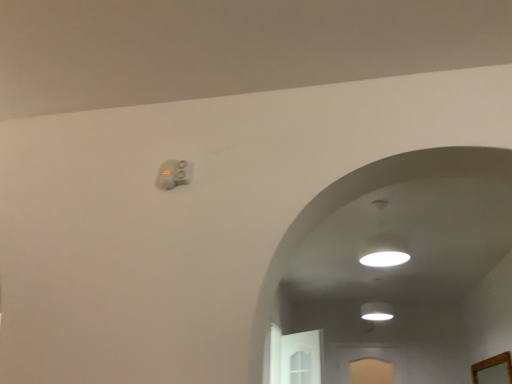
Question: Considering the relative sizes of wooden mirror at lower right and white glossy lampshade at upper center in the image provided, is wooden mirror at lower right smaller than white glossy lampshade at upper center?

Choices:
 (A) yes
 (B) no

Answer: (A)

Question: Considering the relative positions of wooden mirror at lower right and white glossy lampshade at upper center in the image provided, is wooden mirror at lower right to the right of white glossy lampshade at upper center from the viewer's perspective?

Choices:
 (A) yes
 (B) no

Answer: (A)

Question: Does wooden mirror at lower right lie behind white glossy lampshade at upper center?

Choices:
 (A) yes
 (B) no

Answer: (A)

Question: From the image's perspective, is wooden mirror at lower right beneath white glossy lampshade at upper center?

Choices:
 (A) yes
 (B) no

Answer: (A)

Question: Considering the relative sizes of wooden mirror at lower right and white glossy lampshade at upper center in the image provided, is wooden mirror at lower right shorter than white glossy lampshade at upper center?

Choices:
 (A) no
 (B) yes

Answer: (B)

Question: From the image's perspective, would you say wooden mirror at lower right is positioned over white glossy lampshade at upper center?

Choices:
 (A) no
 (B) yes

Answer: (A)

Question: Does white glossy lampshade at upper center appear on the right side of wooden mirror at lower right?

Choices:
 (A) no
 (B) yes

Answer: (A)

Question: Is white glossy lampshade at upper center to the left of wooden mirror at lower right from the viewer's perspective?

Choices:
 (A) yes
 (B) no

Answer: (A)

Question: Is white glossy lampshade at upper center turned away from wooden mirror at lower right?

Choices:
 (A) yes
 (B) no

Answer: (B)

Question: Is white glossy lampshade at upper center closer to the viewer compared to wooden mirror at lower right?

Choices:
 (A) yes
 (B) no

Answer: (A)

Question: Is wooden mirror at lower right completely or partially inside white glossy lampshade at upper center?

Choices:
 (A) no
 (B) yes

Answer: (A)

Question: Is the position of white glossy lampshade at upper center more distant than that of wooden mirror at lower right?

Choices:
 (A) yes
 (B) no

Answer: (B)

Question: From the image's perspective, is wooden mirror at lower right positioned above or below white glossy lampshade at upper center?

Choices:
 (A) below
 (B) above

Answer: (A)